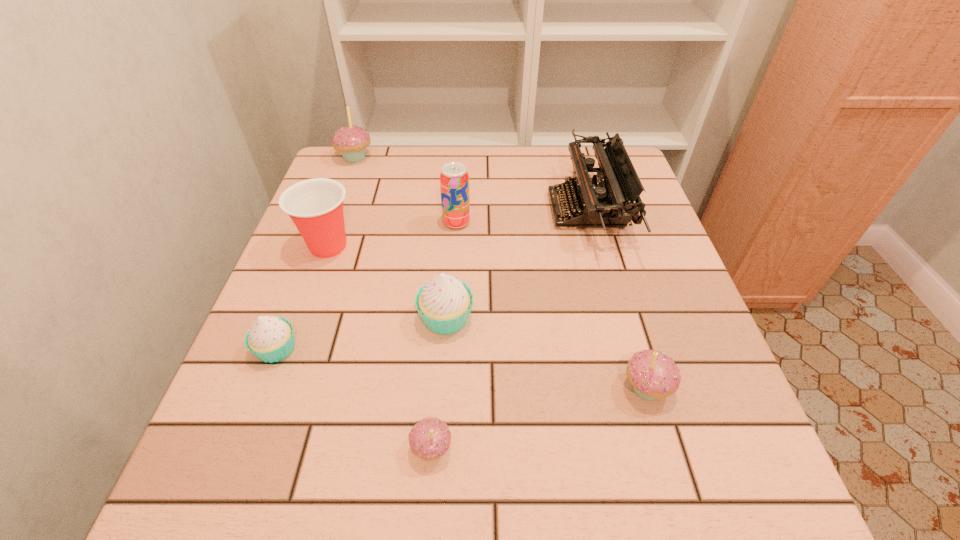
In the image, there is a desktop. In order to click on vacant space at the left edge in this screenshot , I will do `click(297, 397)`.

Image resolution: width=960 pixels, height=540 pixels. Identify the location of vacant region at the right edge of the desktop. (636, 293).

This screenshot has width=960, height=540. In order to click on free space at the far left corner of the desktop in this screenshot , I will do `click(324, 175)`.

The height and width of the screenshot is (540, 960). Find the location of `free spot between the smallest pink cupcake and the farthest pink cupcake`. free spot between the smallest pink cupcake and the farthest pink cupcake is located at coordinates (394, 303).

Where is `vacant area between the left white cupcake and the right white cupcake`? vacant area between the left white cupcake and the right white cupcake is located at coordinates (361, 333).

Identify the location of empty space between the bigger white cupcake and the rightmost cupcake. This screenshot has width=960, height=540. (546, 353).

Where is `vacant space that's between the second pink cupcake from left to right and the typewriter`? Image resolution: width=960 pixels, height=540 pixels. vacant space that's between the second pink cupcake from left to right and the typewriter is located at coordinates (509, 329).

Identify the location of vacant space that's between the typewriter and the biggest pink cupcake. Image resolution: width=960 pixels, height=540 pixels. (470, 184).

Find the location of a particular element. The height and width of the screenshot is (540, 960). vacant area that lies between the soda can and the biggest pink cupcake is located at coordinates (406, 190).

The width and height of the screenshot is (960, 540). What are the coordinates of `vacant area that lies between the rightmost pink cupcake and the typewriter` in the screenshot? It's located at (616, 299).